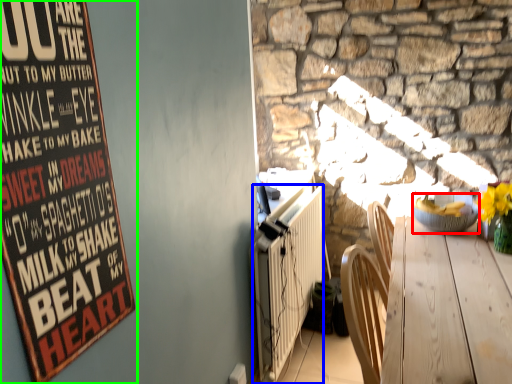
Question: Which object is positioned farthest from bowl (highlighted by a red box)? Select from radiator (highlighted by a blue box) and poster (highlighted by a green box).

Choices:
 (A) radiator
 (B) poster

Answer: (B)